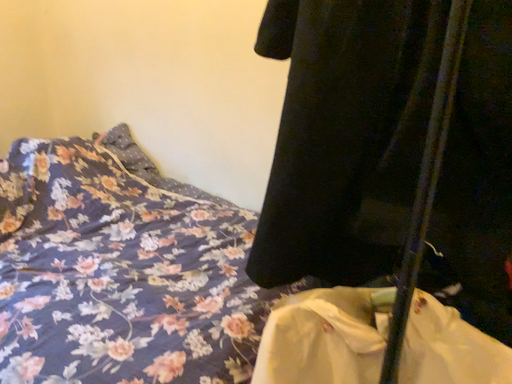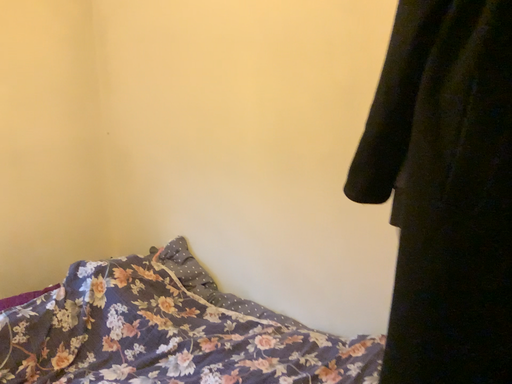
Question: Which way did the camera rotate in the video?

Choices:
 (A) rotated upward
 (B) rotated downward

Answer: (A)